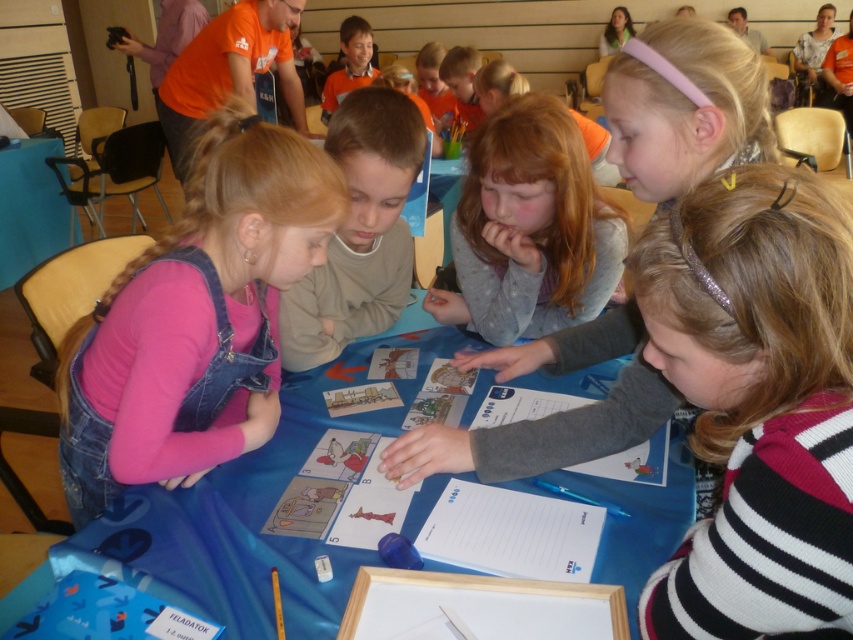
Looking at this image, between blue fabric table at center and gray cotton shirt at center, which one is positioned higher?

gray cotton shirt at center

Is blue fabric table at center above gray cotton shirt at center?

Actually, blue fabric table at center is below gray cotton shirt at center.

Does point (601, 544) come closer to viewer compared to point (584, 225)?

Yes, point (601, 544) is closer to viewer.

This screenshot has width=853, height=640. Find the location of `blue fabric table at center`. blue fabric table at center is located at coordinates (248, 516).

Is pink denim overalls at left positioned at the back of orange matte shirt at upper center?

No, pink denim overalls at left is in front of orange matte shirt at upper center.

Who is more distant from viewer, (x=227, y=300) or (x=364, y=68)?

The point (x=364, y=68) is more distant.

Measure the distance between point (241, 205) and camera.

Point (241, 205) and camera are 1.02 meters apart.

The image size is (853, 640). I want to click on pink denim overalls at left, so click(195, 317).

Consider the image. Between gray cotton shirt at center and light brown sweater at center, which one is positioned lower?

light brown sweater at center is below.

Consider the image. Can you confirm if gray cotton shirt at center is positioned above light brown sweater at center?

Yes.

Where is `gray cotton shirt at center`? gray cotton shirt at center is located at coordinates (529, 228).

Locate an element on the screen. Image resolution: width=853 pixels, height=640 pixels. gray cotton shirt at center is located at coordinates (529, 228).